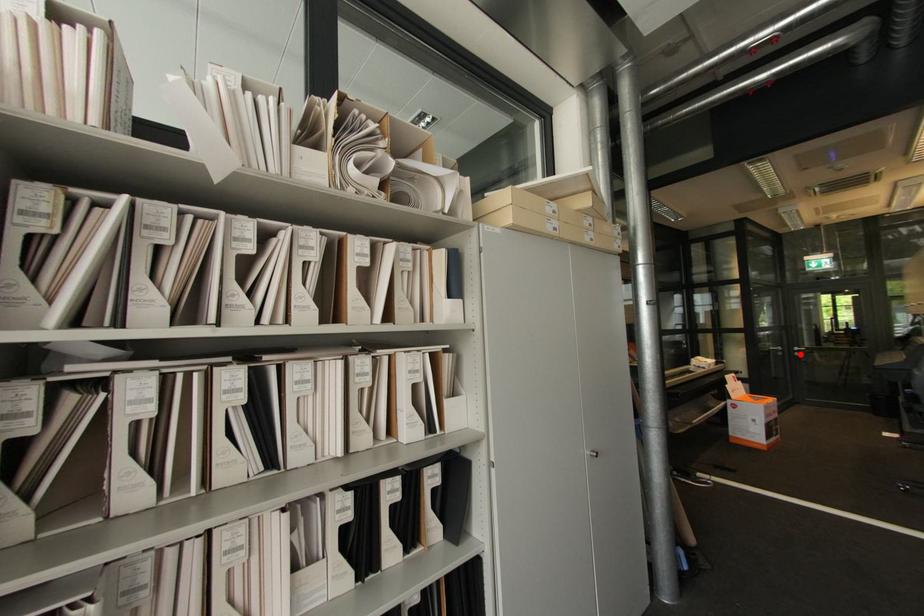
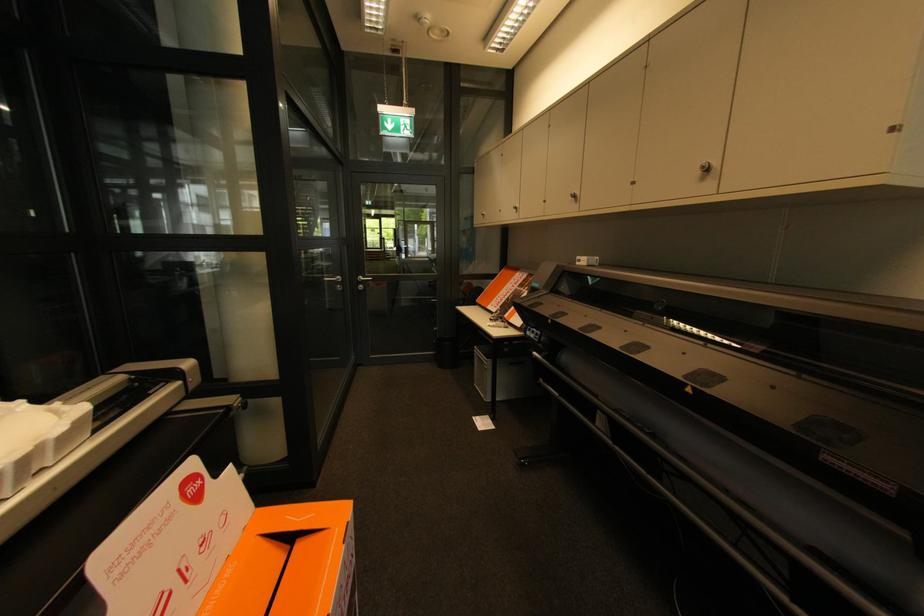
The point at the highlighted location is marked in the first image. Where is the corresponding point in the second image?

(365, 286)